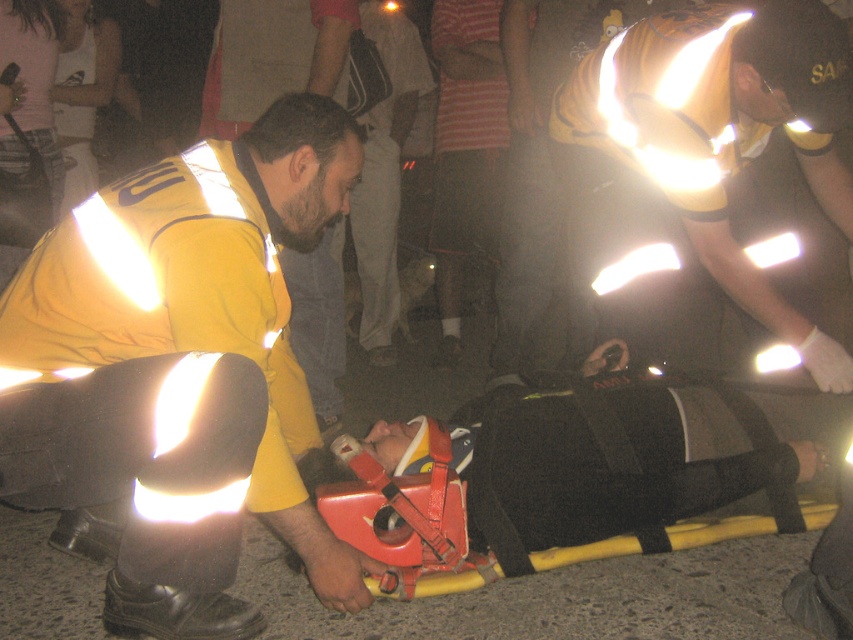
Question: Can you confirm if matte yellow uniform at center is positioned above reflective yellow vest at center?

Choices:
 (A) no
 (B) yes

Answer: (A)

Question: Considering the relative positions of matte yellow uniform at center and reflective yellow vest at center in the image provided, where is matte yellow uniform at center located with respect to reflective yellow vest at center?

Choices:
 (A) below
 (B) above

Answer: (A)

Question: Does matte yellow uniform at center lie behind reflective yellow vest at center?

Choices:
 (A) yes
 (B) no

Answer: (B)

Question: Which object is farther from the camera taking this photo?

Choices:
 (A) reflective yellow vest at center
 (B) matte yellow uniform at center

Answer: (A)